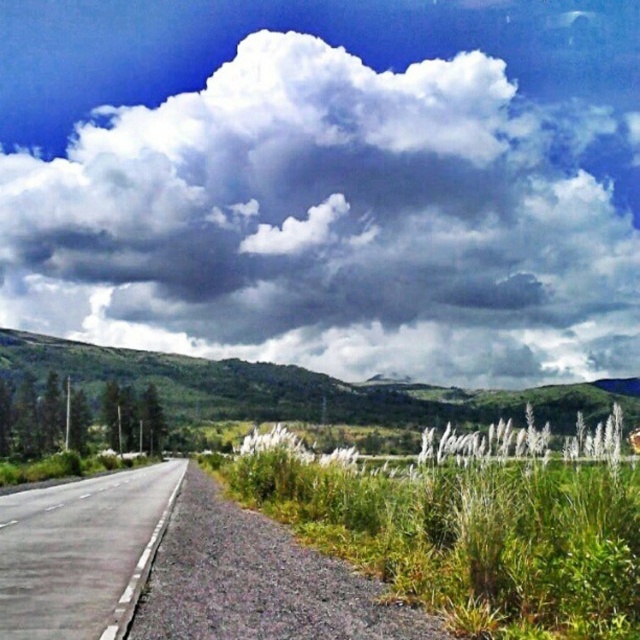
Looking at this image, is white fluffy cloud at upper center positioned behind asphalt road at left?

Yes, white fluffy cloud at upper center is behind asphalt road at left.

Is white fluffy cloud at upper center thinner than asphalt road at left?

No, white fluffy cloud at upper center is not thinner than asphalt road at left.

This screenshot has width=640, height=640. Describe the element at coordinates (326, 225) in the screenshot. I see `white fluffy cloud at upper center` at that location.

Find the location of a particular element. Image resolution: width=640 pixels, height=640 pixels. white fluffy cloud at upper center is located at coordinates (326, 225).